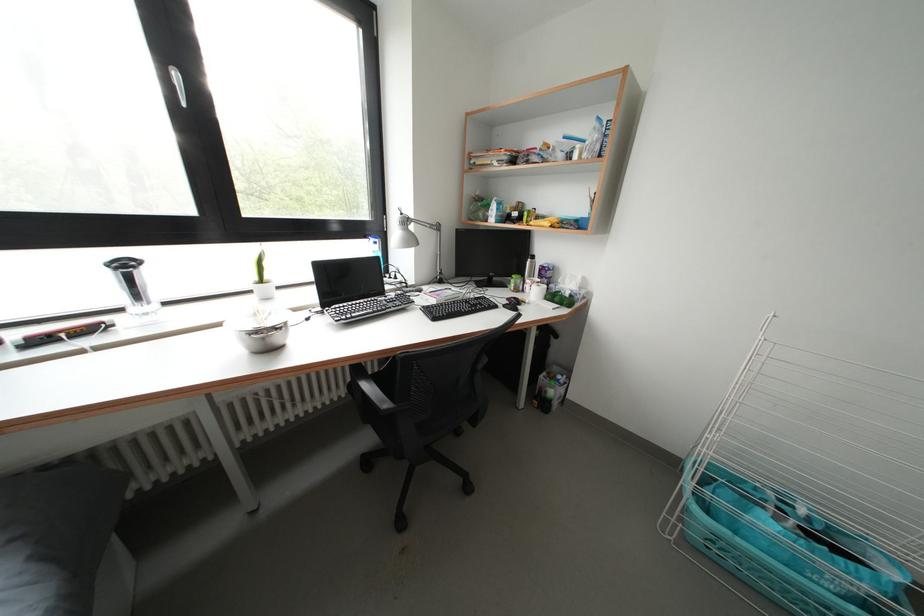
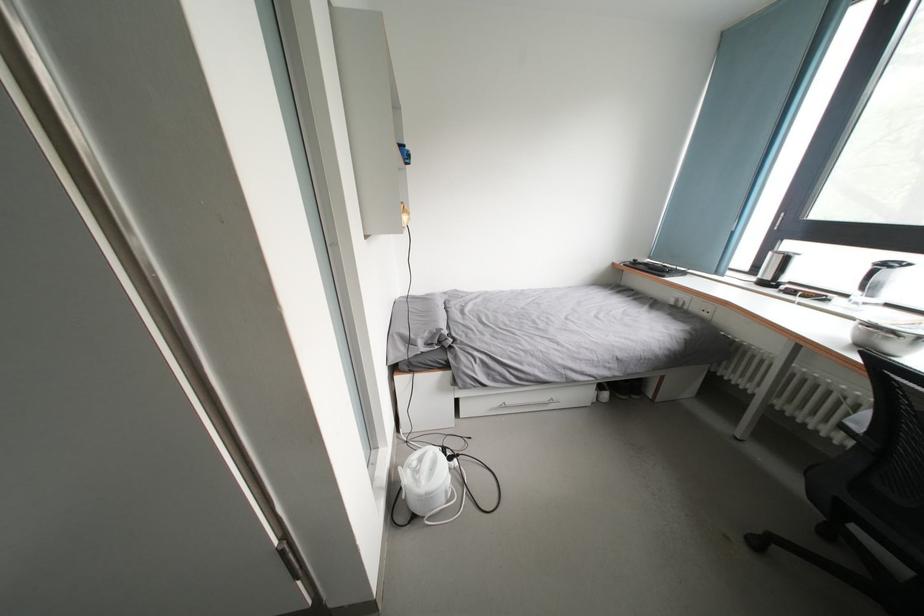
In the second image, find the point that corresponds to (262,337) in the first image.

(877, 331)